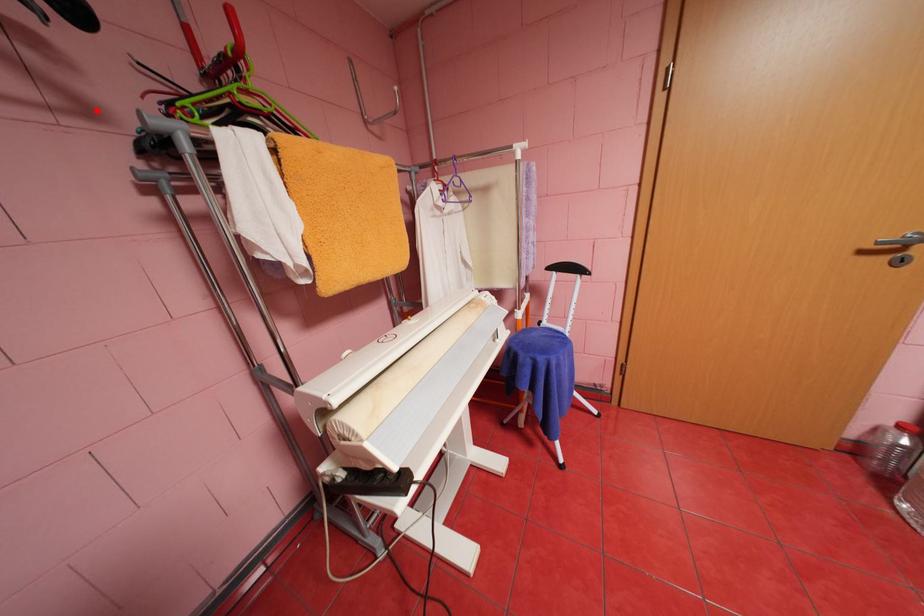
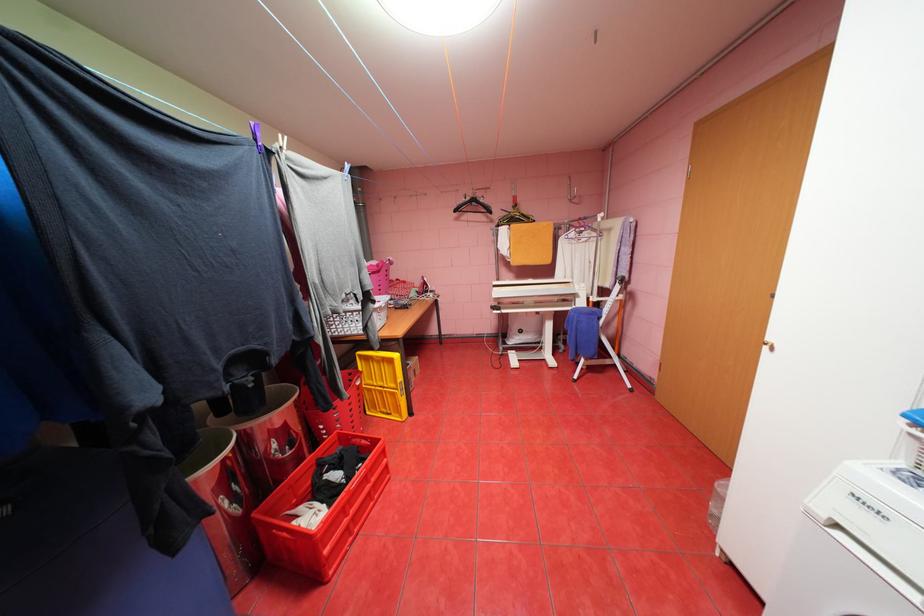
Question: A red point is marked in image1. In image2, is the corresponding 3D point closer to the camera or farther? Reply with the corresponding letter.

Choices:
 (A) The corresponding 3D point is closer.
 (B) The corresponding 3D point is farther.

Answer: (A)